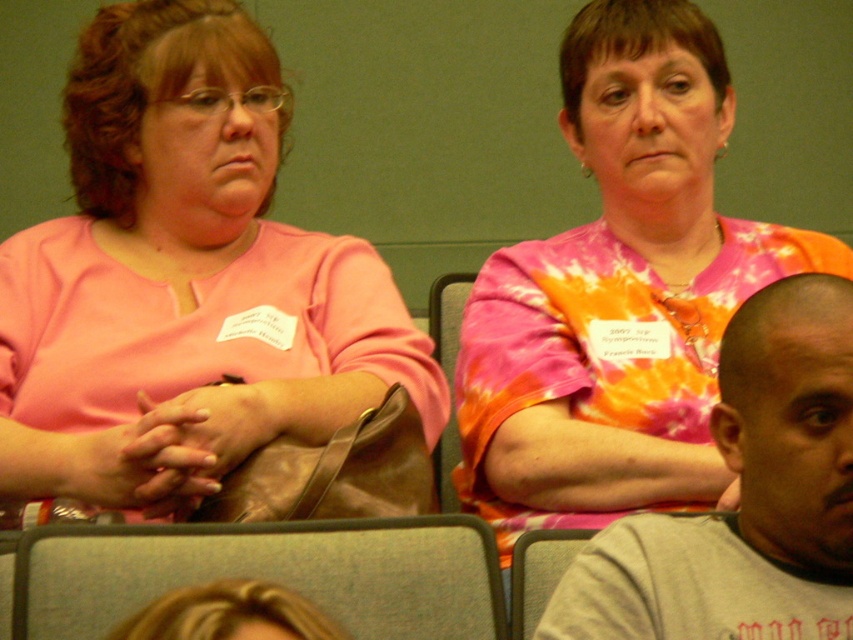
How distant is tie-dye fabric shirt at center from gray cotton shirt at lower right?

The distance of tie-dye fabric shirt at center from gray cotton shirt at lower right is 43.97 centimeters.

Can you confirm if tie-dye fabric shirt at center is positioned to the left of gray cotton shirt at lower right?

Correct, you'll find tie-dye fabric shirt at center to the left of gray cotton shirt at lower right.

Which is behind, point (608, 19) or point (833, 378)?

The point (608, 19) is behind.

The image size is (853, 640). Identify the location of tie-dye fabric shirt at center. (618, 292).

Is pink fabric shirt at upper left above gray cotton shirt at lower right?

Correct, pink fabric shirt at upper left is located above gray cotton shirt at lower right.

Is point (236, 273) positioned after point (704, 600)?

Yes, it is.

Locate an element on the screen. pink fabric shirt at upper left is located at coordinates (184, 280).

Locate an element on the screen. The height and width of the screenshot is (640, 853). pink fabric shirt at upper left is located at coordinates (184, 280).

Is point (85, 182) farther from viewer compared to point (672, 236)?

That is False.

Does pink fabric shirt at upper left appear under tie-dye fabric shirt at center?

No, pink fabric shirt at upper left is not below tie-dye fabric shirt at center.

In the scene shown: Measure the distance between point (108, 29) and camera.

Point (108, 29) and camera are 1.72 meters apart.

Image resolution: width=853 pixels, height=640 pixels. I want to click on pink fabric shirt at upper left, so click(x=184, y=280).